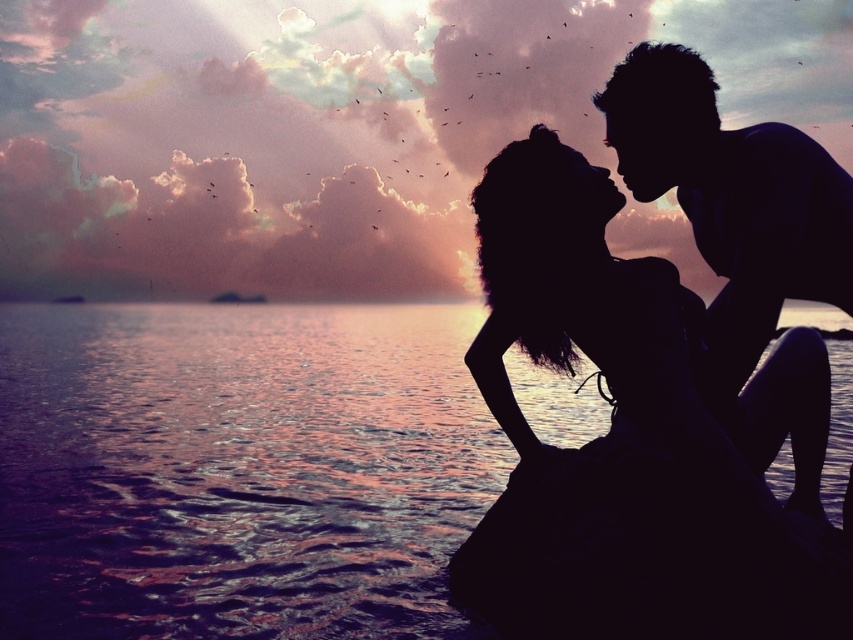
Between reflective blue water at lower left and silhouette man at upper right, which one appears on the left side from the viewer's perspective?

silhouette man at upper right

Can you confirm if reflective blue water at lower left is positioned above silhouette man at upper right?

No.

Which is behind, point (115, 371) or point (709, 342)?

The point (115, 371) is more distant.

Image resolution: width=853 pixels, height=640 pixels. What are the coordinates of `reflective blue water at lower left` in the screenshot? It's located at (238, 468).

Does black matte dress at center have a smaller size compared to silhouette man at upper right?

Incorrect, black matte dress at center is not smaller in size than silhouette man at upper right.

Does point (645, 317) come farther from viewer compared to point (775, 196)?

No, it is in front of (775, 196).

You are a GUI agent. You are given a task and a screenshot of the screen. Output one action in this format:
    pyautogui.click(x=<x>, y=<y>)
    Task: Click on the black matte dress at center
    
    Given the screenshot: What is the action you would take?
    pyautogui.click(x=635, y=442)

Does reflective blue water at lower left have a lesser height compared to black matte dress at center?

No.

What do you see at coordinates (238, 468) in the screenshot? I see `reflective blue water at lower left` at bounding box center [238, 468].

The image size is (853, 640). Describe the element at coordinates (238, 468) in the screenshot. I see `reflective blue water at lower left` at that location.

Where is `reflective blue water at lower left`? The image size is (853, 640). reflective blue water at lower left is located at coordinates (238, 468).